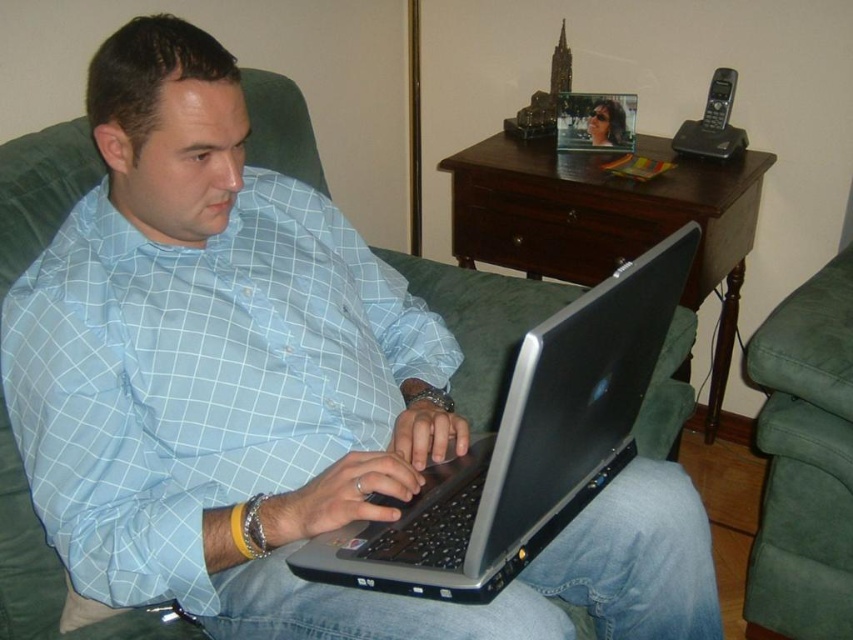
Based on the photo, which is below, light blue checkered shirt at center or silver metallic laptop at center?

silver metallic laptop at center is below.

Is light blue checkered shirt at center positioned in front of silver metallic laptop at center?

No.

In order to click on light blue checkered shirt at center in this screenshot , I will do `click(199, 378)`.